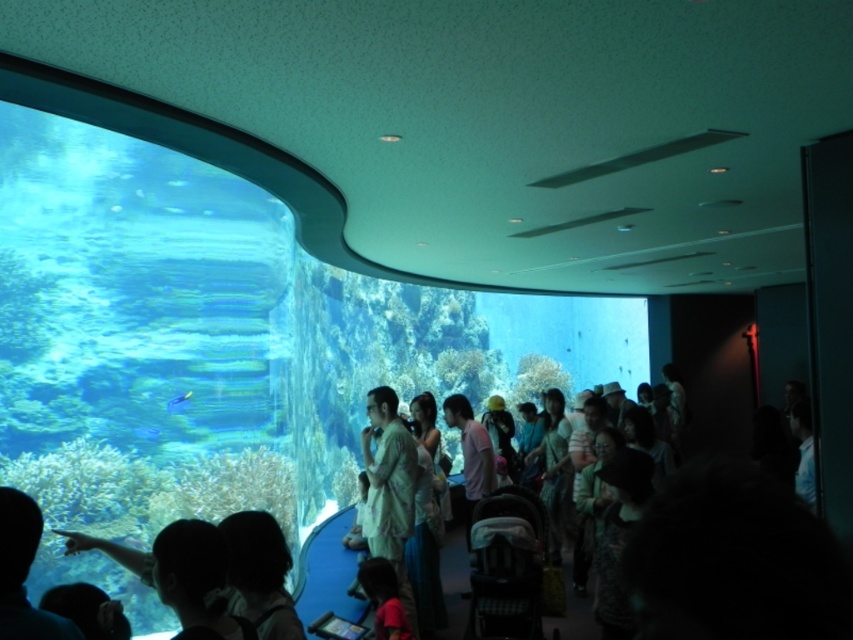
Question: Does blue glossy fish at lower center come in front of blue glossy fish at center?

Choices:
 (A) no
 (B) yes

Answer: (A)

Question: Which of the following is the closest to the observer?

Choices:
 (A) blue glossy fish at lower center
 (B) blue glossy fish at center
 (C) matte red shirt at lower center

Answer: (C)

Question: Which of these objects is positioned farthest from the blue glossy fish at lower center?

Choices:
 (A) blue glossy fish at center
 (B) matte red shirt at lower center

Answer: (B)

Question: Considering the relative positions of matte red shirt at lower center and blue glossy fish at lower center in the image provided, where is matte red shirt at lower center located with respect to blue glossy fish at lower center?

Choices:
 (A) left
 (B) right

Answer: (B)

Question: Based on their relative distances, which object is nearer to the blue glossy fish at lower center?

Choices:
 (A) blue glossy fish at center
 (B) matte red shirt at lower center

Answer: (A)

Question: Can you confirm if matte red shirt at lower center is smaller than blue glossy fish at lower center?

Choices:
 (A) no
 (B) yes

Answer: (A)